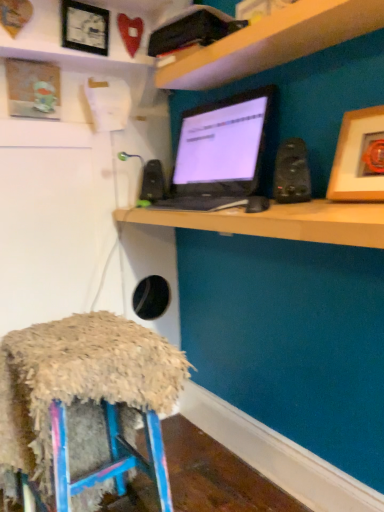
Question: Would you say black matte speaker at center, arranged as the first speaker when viewed from the back, is part of black glossy laptop at center's contents?

Choices:
 (A) yes
 (B) no

Answer: (B)

Question: Considering the relative sizes of black glossy laptop at center and black matte speaker at center, arranged as the first speaker when viewed from the back, in the image provided, is black glossy laptop at center shorter than black matte speaker at center, arranged as the first speaker when viewed from the back,?

Choices:
 (A) yes
 (B) no

Answer: (B)

Question: Is black glossy laptop at center next to black matte speaker at center, which is the second speaker from front to back?

Choices:
 (A) yes
 (B) no

Answer: (B)

Question: From the image's perspective, does black glossy laptop at center appear higher than black matte speaker at center, marked as the 1th speaker in a left-to-right arrangement?

Choices:
 (A) no
 (B) yes

Answer: (B)

Question: Can you confirm if black glossy laptop at center is thinner than black matte speaker at center, which is the second speaker from front to back?

Choices:
 (A) yes
 (B) no

Answer: (B)

Question: Does black glossy laptop at center have a greater width compared to black matte speaker at center, arranged as the first speaker when viewed from the back?

Choices:
 (A) yes
 (B) no

Answer: (A)

Question: Is wooden framed picture at upper left, the 2th picture frame from the right, positioned with its back to black glossy monitor at center?

Choices:
 (A) no
 (B) yes

Answer: (A)

Question: Is wooden framed picture at upper left, which appears as the second picture frame when viewed from the front, far away from black glossy monitor at center?

Choices:
 (A) yes
 (B) no

Answer: (B)

Question: Considering the relative sizes of wooden framed picture at upper left, the 2th picture frame from the left, and black glossy monitor at center in the image provided, is wooden framed picture at upper left, the 2th picture frame from the left, shorter than black glossy monitor at center?

Choices:
 (A) yes
 (B) no

Answer: (B)

Question: Considering the relative positions of wooden framed picture at upper left, which is the second picture frame in back-to-front order, and black glossy monitor at center in the image provided, is wooden framed picture at upper left, which is the second picture frame in back-to-front order, in front of black glossy monitor at center?

Choices:
 (A) yes
 (B) no

Answer: (B)

Question: From the image's perspective, is wooden framed picture at upper left, which appears as the second picture frame when viewed from the front, below black glossy monitor at center?

Choices:
 (A) no
 (B) yes

Answer: (A)

Question: Does wooden framed picture at upper left, the 2th picture frame from the right, have a lesser width compared to black glossy monitor at center?

Choices:
 (A) no
 (B) yes

Answer: (B)

Question: Would you consider wooden framed picture at upper left, the 2th picture frame from the left, to be distant from wooden picture frame at upper right, the 1th picture frame in the right-to-left sequence?

Choices:
 (A) yes
 (B) no

Answer: (A)